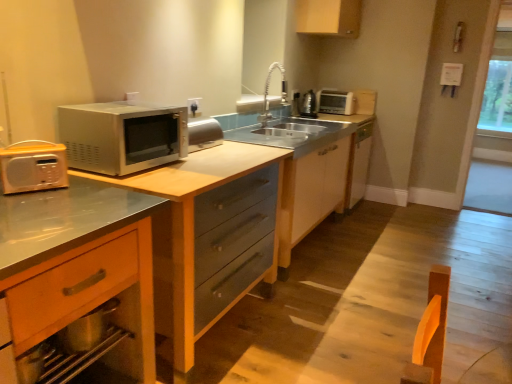
Question: Which direction should I rotate to look at white plastic electric outlet at upper center?

Choices:
 (A) right
 (B) left

Answer: (B)

Question: Could you tell me if metallic silver microwave at left is turned towards white matte cabinet at center, which is the second cabinetry in bottom-to-top order?

Choices:
 (A) no
 (B) yes

Answer: (A)

Question: Does metallic silver microwave at left come behind white matte cabinet at center, the 3th cabinetry from the left?

Choices:
 (A) yes
 (B) no

Answer: (B)

Question: Is metallic silver microwave at left thinner than white matte cabinet at center, the 2th cabinetry in the top-to-bottom sequence?

Choices:
 (A) yes
 (B) no

Answer: (B)

Question: Considering the relative sizes of metallic silver microwave at left and white matte cabinet at center, the 2th cabinetry in the top-to-bottom sequence, in the image provided, is metallic silver microwave at left bigger than white matte cabinet at center, the 2th cabinetry in the top-to-bottom sequence,?

Choices:
 (A) no
 (B) yes

Answer: (B)

Question: From the image's perspective, does metallic silver microwave at left appear higher than white matte cabinet at center, which ranks as the first cabinetry in right-to-left order?

Choices:
 (A) yes
 (B) no

Answer: (B)

Question: Does metallic silver microwave at left have a lesser height compared to white matte cabinet at center, which ranks as the first cabinetry in right-to-left order?

Choices:
 (A) yes
 (B) no

Answer: (B)

Question: From a real-world perspective, is white plastic toaster at upper right over white matte cabinet at center, the 2th cabinetry in the top-to-bottom sequence?

Choices:
 (A) yes
 (B) no

Answer: (A)

Question: Is white plastic toaster at upper right bigger than white matte cabinet at center, which ranks as the first cabinetry in right-to-left order?

Choices:
 (A) no
 (B) yes

Answer: (A)

Question: From the image's perspective, does white plastic toaster at upper right appear higher than white matte cabinet at center, which is the second cabinetry in bottom-to-top order?

Choices:
 (A) yes
 (B) no

Answer: (A)

Question: Is white plastic toaster at upper right closer to camera compared to white matte cabinet at center, which is the second cabinetry in bottom-to-top order?

Choices:
 (A) yes
 (B) no

Answer: (B)

Question: Considering the relative sizes of white plastic toaster at upper right and white matte cabinet at center, which is the second cabinetry in bottom-to-top order, in the image provided, is white plastic toaster at upper right smaller than white matte cabinet at center, which is the second cabinetry in bottom-to-top order,?

Choices:
 (A) yes
 (B) no

Answer: (A)

Question: Is white plastic toaster at upper right not within white matte cabinet at center, which is the second cabinetry in bottom-to-top order?

Choices:
 (A) no
 (B) yes

Answer: (B)

Question: Is metallic silver microwave at left oriented towards satin nickel faucet at center?

Choices:
 (A) no
 (B) yes

Answer: (A)